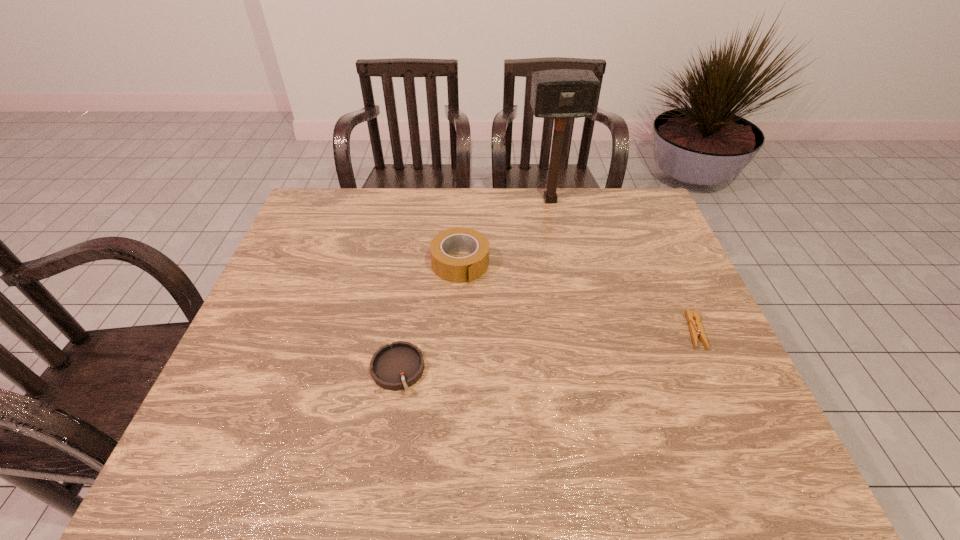
Where is `vacant space at the left edge of the desktop`? vacant space at the left edge of the desktop is located at coordinates (326, 279).

The width and height of the screenshot is (960, 540). In the image, there is a desktop. Find the location of `vacant area at the right edge`. vacant area at the right edge is located at coordinates (686, 282).

The height and width of the screenshot is (540, 960). I want to click on free spot at the far left corner of the desktop, so click(x=352, y=196).

The height and width of the screenshot is (540, 960). Find the location of `vacant space that is in between the third tallest object and the rightmost object`. vacant space that is in between the third tallest object and the rightmost object is located at coordinates (546, 350).

This screenshot has height=540, width=960. What are the coordinates of `unoccupied area between the second tallest object and the third object from left to right` in the screenshot? It's located at (505, 232).

Identify the location of vacant point located between the third shortest object and the third object from left to right. This screenshot has height=540, width=960. (505, 232).

At what (x,y) coordinates should I click in order to perform the action: click on vacant point located between the second shortest object and the second tallest object. Please return your answer as a coordinate pair (x, y). Looking at the image, I should click on (429, 317).

Where is `free space between the third shortest object and the third object from left to right`? free space between the third shortest object and the third object from left to right is located at coordinates (505, 232).

In order to click on free spot between the tallest object and the rightmost object in this screenshot , I will do `click(622, 266)`.

Where is `free space between the clothespin and the tallest object`? The width and height of the screenshot is (960, 540). free space between the clothespin and the tallest object is located at coordinates (622, 266).